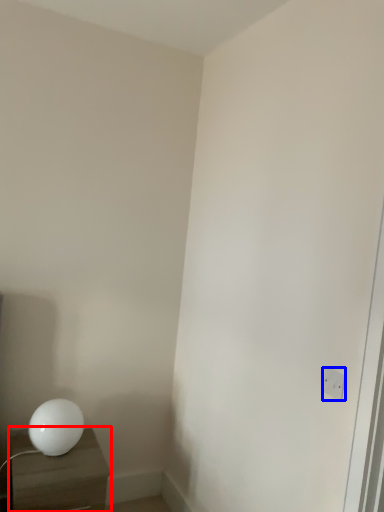
Question: Among these objects, which one is nearest to the camera, nightstand (highlighted by a red box) or electric outlet (highlighted by a blue box)?

Choices:
 (A) nightstand
 (B) electric outlet

Answer: (B)